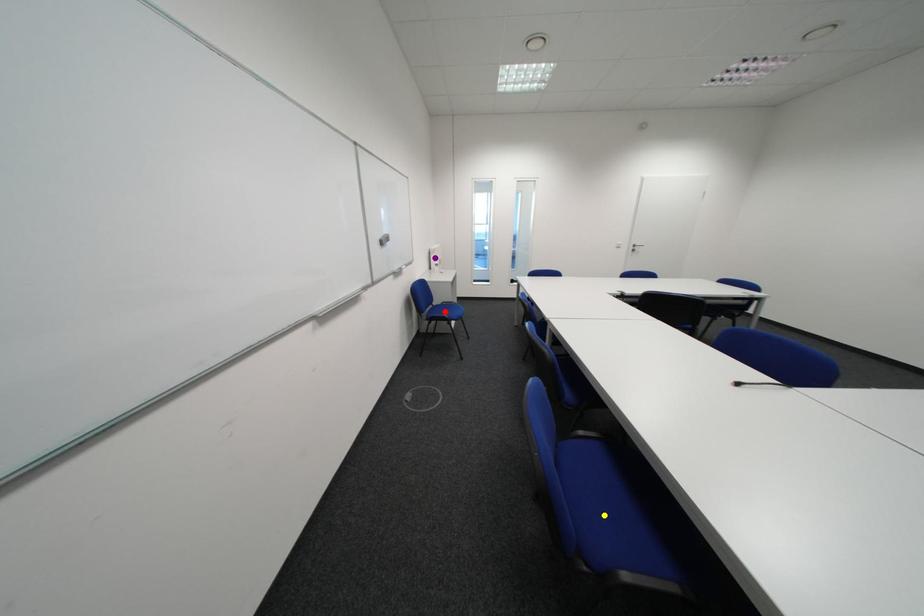
In the scene shown: Order these from nearest to farthest:
A) yellow point
B) purple point
C) red point

purple point → red point → yellow point